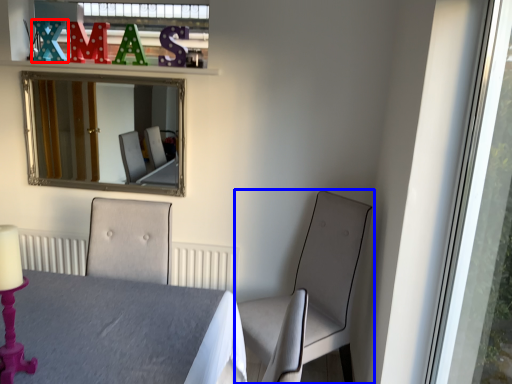
Question: Which of the following is the closest to the observer, alphabet (highlighted by a red box) or chair (highlighted by a blue box)?

Choices:
 (A) alphabet
 (B) chair

Answer: (B)